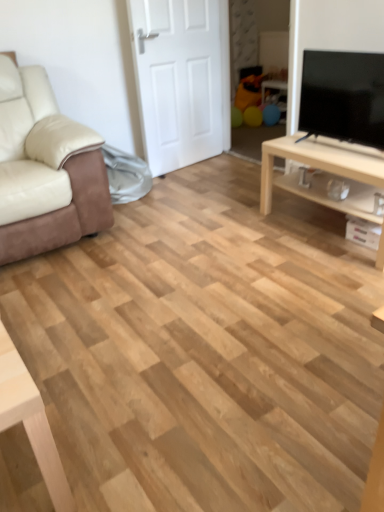
Locate an element on the screen. The image size is (384, 512). vacant region to the right of beige leather couch at left is located at coordinates (176, 218).